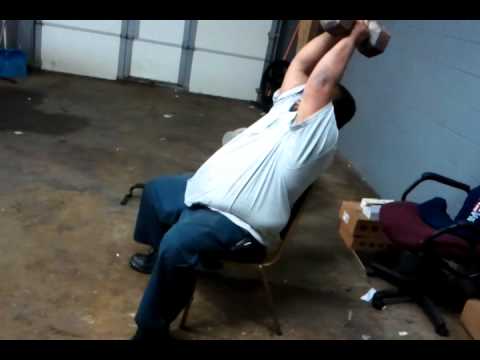
Find the location of `chair`. chair is located at coordinates (253, 268), (410, 232).